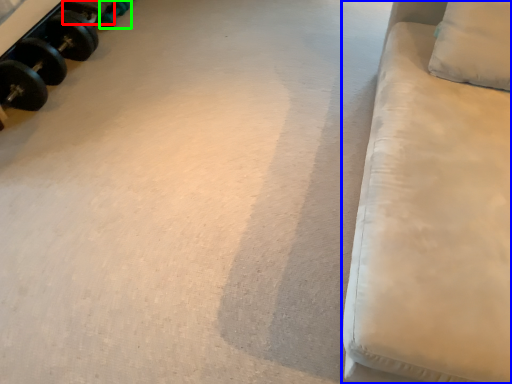
Question: Which is nearer to the dumbbell (highlighted by a red box)? furniture (highlighted by a blue box) or dumbbell (highlighted by a green box).

Choices:
 (A) furniture
 (B) dumbbell

Answer: (B)